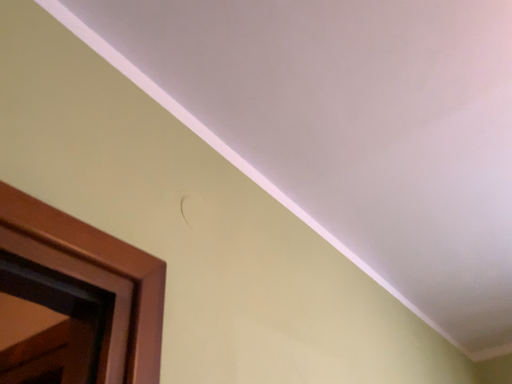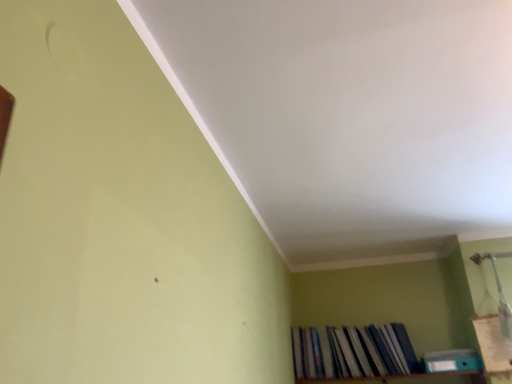
Question: How did the camera likely rotate when shooting the video?

Choices:
 (A) rotated upward
 (B) rotated downward

Answer: (B)